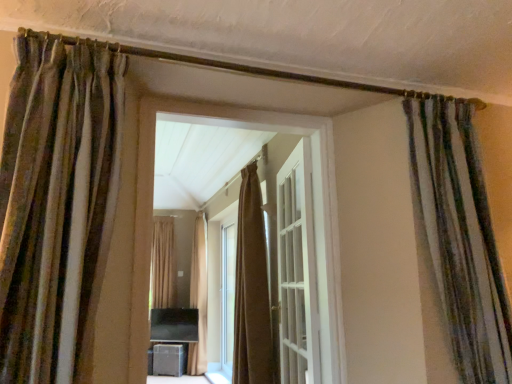
Question: From a real-world perspective, is brown velvet curtain at center, which is the 4th curtain from left to right, positioned over brown textured curtain at left, which is the third curtain in right-to-left order, based on gravity?

Choices:
 (A) no
 (B) yes

Answer: (A)

Question: Does brown velvet curtain at center, which is the 2th curtain from right to left, have a lesser width compared to brown textured curtain at left, which is the third curtain in right-to-left order?

Choices:
 (A) no
 (B) yes

Answer: (A)

Question: Is brown velvet curtain at center, the 3th curtain viewed from the front, outside brown textured curtain at left, positioned as the 1th curtain in front-to-back order?

Choices:
 (A) yes
 (B) no

Answer: (A)

Question: From the image's perspective, is brown velvet curtain at center, which is the 4th curtain from left to right, under brown textured curtain at left, acting as the 3th curtain starting from the left?

Choices:
 (A) no
 (B) yes

Answer: (B)

Question: From a real-world perspective, is brown velvet curtain at center, which is the 2th curtain from right to left, beneath brown textured curtain at left, the fifth curtain positioned from the back?

Choices:
 (A) no
 (B) yes

Answer: (B)

Question: From a real-world perspective, relative to brown textured curtain at center, which appears as the first curtain when viewed from the back, is brown curtain at center vertically above or below?

Choices:
 (A) below
 (B) above

Answer: (A)

Question: Considering their positions, is brown curtain at center located in front of or behind brown textured curtain at center, marked as the first curtain in a left-to-right arrangement?

Choices:
 (A) behind
 (B) front

Answer: (B)

Question: Considering the positions of brown curtain at center and brown textured curtain at center, marked as the first curtain in a left-to-right arrangement, in the image, is brown curtain at center taller or shorter than brown textured curtain at center, marked as the first curtain in a left-to-right arrangement,?

Choices:
 (A) tall
 (B) short

Answer: (B)

Question: Is brown curtain at center to the left or to the right of brown textured curtain at center, placed as the fifth curtain when sorted from front to back, in the image?

Choices:
 (A) right
 (B) left

Answer: (A)

Question: Considering the positions of point (189, 364) and point (92, 327), is point (189, 364) closer or farther from the camera than point (92, 327)?

Choices:
 (A) closer
 (B) farther

Answer: (B)

Question: From a real-world perspective, relative to brown textured curtain at left, which is the third curtain in right-to-left order, is beige fabric curtain at center, which is counted as the 2th curtain, starting from the back, vertically above or below?

Choices:
 (A) below
 (B) above

Answer: (A)

Question: In terms of height, does beige fabric curtain at center, the 4th curtain from the front, look taller or shorter compared to brown textured curtain at left, which is the third curtain in right-to-left order?

Choices:
 (A) tall
 (B) short

Answer: (A)

Question: Considering their positions, is beige fabric curtain at center, which is counted as the 2th curtain, starting from the back, located in front of or behind brown textured curtain at left, which is the third curtain in right-to-left order?

Choices:
 (A) front
 (B) behind

Answer: (B)

Question: In the image, is matte black speaker at lower center positioned in front of or behind brown velvet curtain at center, the 3th curtain viewed from the front?

Choices:
 (A) front
 (B) behind

Answer: (B)

Question: From the image's perspective, is matte black speaker at lower center above or below brown velvet curtain at center, which is the 2th curtain from right to left?

Choices:
 (A) below
 (B) above

Answer: (A)